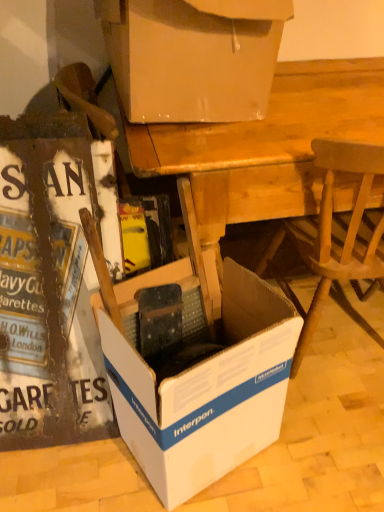
This screenshot has width=384, height=512. What do you see at coordinates (197, 373) in the screenshot? I see `white cardboard box at center, the 1th box from the bottom` at bounding box center [197, 373].

Find the location of `wooden desk at center`. wooden desk at center is located at coordinates (264, 151).

Find the location of a particular element. This screenshot has width=384, height=512. white cardboard box at upper center, placed as the 3th box when sorted from bottom to top is located at coordinates (193, 57).

What is the approximate height of white cardboard box at upper center, which is the first box from top to bottom?

It is 13.82 inches.

Where is `white cardboard box at lower left, the second box from the top`? This screenshot has width=384, height=512. white cardboard box at lower left, the second box from the top is located at coordinates (47, 286).

What do you see at coordinates (337, 233) in the screenshot?
I see `wooden chair at lower right` at bounding box center [337, 233].

Where is `white cardboard box at center, the 1th box from the bottom`? The height and width of the screenshot is (512, 384). white cardboard box at center, the 1th box from the bottom is located at coordinates (197, 373).

Could you measure the distance between white cardboard box at lower left, the second box from the top, and wooden desk at center?

They are 54.18 centimeters apart.

Is wooden desk at center surrounded by white cardboard box at lower left, the 2th box ordered from the bottom?

No, white cardboard box at lower left, the 2th box ordered from the bottom, does not contain wooden desk at center.

Is point (101, 371) closer or farther from the camera than point (304, 63)?

Point (101, 371) is closer to the camera than point (304, 63).

Considering the relative positions of white cardboard box at lower left, the second box from the top, and wooden chair at lower right in the image provided, is white cardboard box at lower left, the second box from the top, to the left or to the right of wooden chair at lower right?

white cardboard box at lower left, the second box from the top, is positioned on wooden chair at lower right's left side.

From the image's perspective, is white cardboard box at lower left, the second box from the top, positioned above or below wooden chair at lower right?

white cardboard box at lower left, the second box from the top, is situated lower than wooden chair at lower right in the image.

Considering the relative sizes of white cardboard box at lower left, the 2th box ordered from the bottom, and wooden chair at lower right in the image provided, is white cardboard box at lower left, the 2th box ordered from the bottom, smaller than wooden chair at lower right?

Indeed, white cardboard box at lower left, the 2th box ordered from the bottom, has a smaller size compared to wooden chair at lower right.

Based on the photo, which is nearer, (72, 341) or (319, 286)?

The point (72, 341) is more forward.

Considering the sizes of objects wooden chair at lower right and white cardboard box at center, the third box viewed from the top, in the image provided, who is shorter, wooden chair at lower right or white cardboard box at center, the third box viewed from the top,?

Standing shorter between the two is white cardboard box at center, the third box viewed from the top.

From a real-world perspective, is wooden chair at lower right physically below white cardboard box at center, the third box viewed from the top?

No, from a real-world perspective, wooden chair at lower right is not beneath white cardboard box at center, the third box viewed from the top.

Looking at this image, is wooden chair at lower right beside white cardboard box at center, the third box viewed from the top?

wooden chair at lower right and white cardboard box at center, the third box viewed from the top, are clearly separated.

Is point (316, 320) positioned behind point (189, 475)?

Yes, it is behind point (189, 475).

From a real-world perspective, who is located higher, white cardboard box at center, the 1th box from the bottom, or wooden desk at center?

In real-world perspective, wooden desk at center is above.

In terms of height, does white cardboard box at center, the 1th box from the bottom, look taller or shorter compared to wooden desk at center?

Considering their sizes, white cardboard box at center, the 1th box from the bottom, has less height than wooden desk at center.

Considering the points (182, 422) and (209, 178), which point is behind, point (182, 422) or point (209, 178)?

The point (209, 178) is farther.

Looking at this image, which is behind, white cardboard box at center, the third box viewed from the top, or wooden desk at center?

wooden desk at center.

Image resolution: width=384 pixels, height=512 pixels. In order to click on the 1st box counting from the left side of the white cardboard box at upper center, placed as the 3th box when sorted from bottom to top in this screenshot , I will do `click(197, 373)`.

Is point (217, 464) positioned after point (130, 69)?

Yes, point (217, 464) is farther from viewer.

How many degrees apart are the facing directions of white cardboard box at center, the 1th box from the bottom, and white cardboard box at upper center, which is the first box from top to bottom?

The angular difference between white cardboard box at center, the 1th box from the bottom, and white cardboard box at upper center, which is the first box from top to bottom, is 20.2 degrees.

Considering the sizes of objects white cardboard box at center, the 1th box from the bottom, and white cardboard box at upper center, which is the first box from top to bottom, in the image provided, who is bigger, white cardboard box at center, the 1th box from the bottom, or white cardboard box at upper center, which is the first box from top to bottom,?

white cardboard box at upper center, which is the first box from top to bottom, is bigger.

From a real-world perspective, who is located lower, wooden desk at center or white cardboard box at lower left, the 2th box ordered from the bottom?

wooden desk at center, from a real-world perspective.

Is wooden desk at center in contact with white cardboard box at lower left, the second box from the top?

wooden desk at center and white cardboard box at lower left, the second box from the top, are not in contact.

Between wooden desk at center and white cardboard box at lower left, the 2th box ordered from the bottom, which one has larger width?

With larger width is wooden desk at center.

What's the angular difference between wooden desk at center and white cardboard box at lower left, the second box from the top,'s facing directions?

The angle between the facing direction of wooden desk at center and the facing direction of white cardboard box at lower left, the second box from the top, is 3.63 degrees.

Is white cardboard box at upper center, which is the first box from top to bottom, looking in the opposite direction of white cardboard box at center, the third box viewed from the top?

No, white cardboard box at upper center, which is the first box from top to bottom, is not facing away from white cardboard box at center, the third box viewed from the top.

In the image, is white cardboard box at upper center, which is the first box from top to bottom, positioned in front of or behind white cardboard box at center, the 1th box from the bottom?

white cardboard box at upper center, which is the first box from top to bottom, is positioned farther from the viewer than white cardboard box at center, the 1th box from the bottom.

From a real-world perspective, who is located higher, white cardboard box at upper center, which is the first box from top to bottom, or white cardboard box at center, the 1th box from the bottom?

white cardboard box at upper center, which is the first box from top to bottom.

Consider the image. Looking at their sizes, would you say white cardboard box at upper center, which is the first box from top to bottom, is wider or thinner than white cardboard box at center, the third box viewed from the top?

Considering their sizes, white cardboard box at upper center, which is the first box from top to bottom, looks broader than white cardboard box at center, the third box viewed from the top.

Where is `desk behind the white cardboard box at lower left, the 2th box ordered from the bottom`? This screenshot has width=384, height=512. desk behind the white cardboard box at lower left, the 2th box ordered from the bottom is located at coordinates (264, 151).

Where is `chair above the white cardboard box at lower left, the 2th box ordered from the bottom (from the image's perspective)`? Image resolution: width=384 pixels, height=512 pixels. chair above the white cardboard box at lower left, the 2th box ordered from the bottom (from the image's perspective) is located at coordinates (337, 233).

When comparing their distances from wooden chair at lower right, does wooden desk at center or white cardboard box at center, the third box viewed from the top, seem further?

white cardboard box at center, the third box viewed from the top, is further to wooden chair at lower right.

Looking at the image, which one is located further to white cardboard box at upper center, which is the first box from top to bottom, white cardboard box at lower left, the second box from the top, or white cardboard box at center, the 1th box from the bottom?

The object further to white cardboard box at upper center, which is the first box from top to bottom, is white cardboard box at center, the 1th box from the bottom.

Looking at the image, which one is located closer to white cardboard box at lower left, the second box from the top, wooden chair at lower right or wooden desk at center?

Based on the image, wooden desk at center appears to be nearer to white cardboard box at lower left, the second box from the top.

Considering their positions, is white cardboard box at center, the third box viewed from the top, positioned closer to wooden chair at lower right than wooden desk at center?

wooden desk at center lies closer to wooden chair at lower right than the other object.

When comparing their distances from white cardboard box at lower left, the second box from the top, does wooden chair at lower right or white cardboard box at upper center, placed as the 3th box when sorted from bottom to top, seem further?

wooden chair at lower right.

Looking at the image, which one is located closer to white cardboard box at center, the third box viewed from the top, wooden chair at lower right or wooden desk at center?

wooden desk at center lies closer to white cardboard box at center, the third box viewed from the top, than the other object.

Estimate the real-world distances between objects in this image. Which object is closer to white cardboard box at upper center, placed as the 3th box when sorted from bottom to top, wooden chair at lower right or white cardboard box at center, the third box viewed from the top?

wooden chair at lower right.

Which object lies nearer to the anchor point wooden chair at lower right, white cardboard box at lower left, the second box from the top, or white cardboard box at upper center, which is the first box from top to bottom?

white cardboard box at upper center, which is the first box from top to bottom, is closer to wooden chair at lower right.

Identify the location of box between white cardboard box at upper center, placed as the 3th box when sorted from bottom to top, and white cardboard box at center, the third box viewed from the top, in the vertical direction. The height and width of the screenshot is (512, 384). (47, 286).

Where is `desk between white cardboard box at upper center, placed as the 3th box when sorted from bottom to top, and wooden chair at lower right vertically`? desk between white cardboard box at upper center, placed as the 3th box when sorted from bottom to top, and wooden chair at lower right vertically is located at coordinates pyautogui.click(x=264, y=151).

The image size is (384, 512). I want to click on chair between wooden desk at center and white cardboard box at center, the 1th box from the bottom, vertically, so click(337, 233).

What are the coordinates of `chair between white cardboard box at upper center, which is the first box from top to bottom, and white cardboard box at center, the 1th box from the bottom, from top to bottom` in the screenshot? It's located at (337, 233).